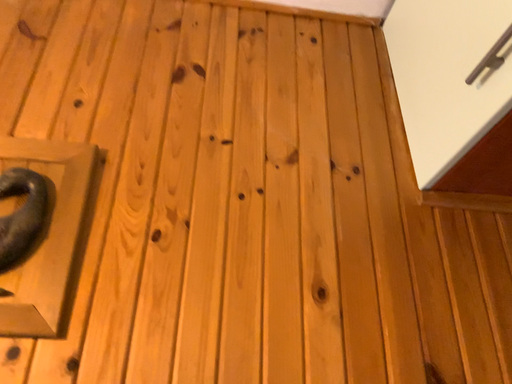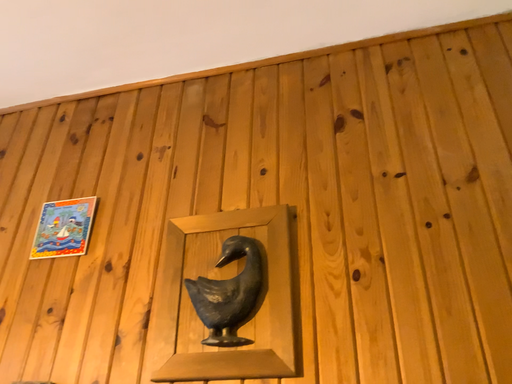
Question: How did the camera likely rotate when shooting the video?

Choices:
 (A) rotated left
 (B) rotated right

Answer: (A)